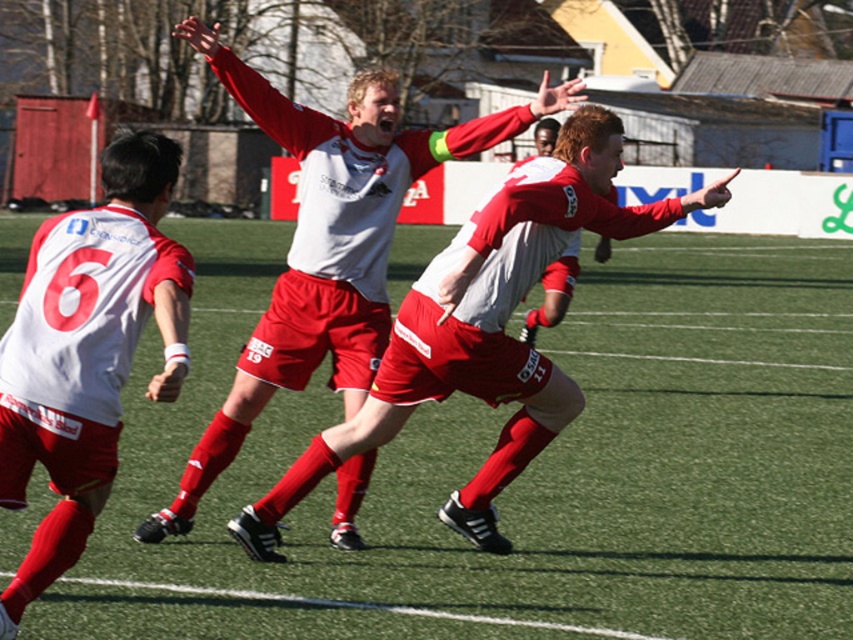
You are a soccer coach analyzing the game footage. You notice two players in the frame, the matte red shorts at center and the white matte jersey at left. Based on their positions and the scene description, which player is positioned closer to the camera?

The matte red shorts at center is much taller as the white matte jersey at left, so the matte red shorts at center is closer to the camera since objects closer to the camera appear larger.

You are a sports commentator watching the soccer match. You notice two players in the frame, one wearing matte red shorts at center and another in white matte jersey at left. Which player is closer to the camera based on their clothing size?

The matte red shorts at center is larger in size than the white matte jersey at left, so the player wearing the matte red shorts at center is closer to the camera.

You are a soccer referee observing the match. You notice the matte red shorts at center and the white matte jersey at left. Based on their positions, which player is more likely to be in the middle of the field?

The matte red shorts at center is more likely to be in the middle of the field since it is positioned at the center, whereas the white matte jersey at left is located on the left side.